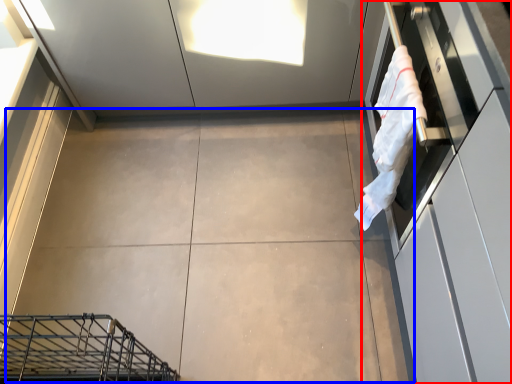
Question: Which point is further to the camera, cabinetry (highlighted by a red box) or concrete (highlighted by a blue box)?

Choices:
 (A) cabinetry
 (B) concrete

Answer: (B)